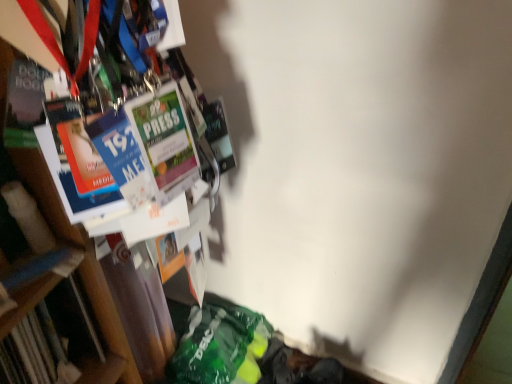
The image size is (512, 384). What do you see at coordinates (79, 321) in the screenshot?
I see `wooden bookcase at left` at bounding box center [79, 321].

Where is `wooden bookcase at left`? This screenshot has height=384, width=512. wooden bookcase at left is located at coordinates (79, 321).

The image size is (512, 384). Describe the element at coordinates (36, 351) in the screenshot. I see `hardcover book at left` at that location.

You are a GUI agent. You are given a task and a screenshot of the screen. Output one action in this format:
    pyautogui.click(x=<x>, y=<y>)
    Task: Click on the hardcover book at left
    The width and height of the screenshot is (512, 384).
    Given the screenshot: What is the action you would take?
    pyautogui.click(x=36, y=351)

At what (x,y) coordinates should I click in order to perform the action: click on wooden bookcase at left. Please return your answer as a coordinate pair (x, y). The width and height of the screenshot is (512, 384). Looking at the image, I should click on (79, 321).

Consider the image. Considering the relative positions of wooden bookcase at left and hardcover book at left in the image provided, is wooden bookcase at left to the right of hardcover book at left from the viewer's perspective?

Yes, wooden bookcase at left is to the right of hardcover book at left.

Relative to hardcover book at left, is wooden bookcase at left in front or behind?

In the image, wooden bookcase at left appears in front of hardcover book at left.

Considering the positions of points (115, 335) and (15, 370), is point (115, 335) closer to camera compared to point (15, 370)?

No, it is behind (15, 370).

Based on the photo, from the image's perspective, which one is positioned higher, wooden bookcase at left or hardcover book at left?

wooden bookcase at left.

From a real-world perspective, is wooden bookcase at left positioned under hardcover book at left based on gravity?

No, from a real-world perspective, wooden bookcase at left is not below hardcover book at left.

Which of these two, wooden bookcase at left or hardcover book at left, is wider?

Wider between the two is wooden bookcase at left.

Which of these two, wooden bookcase at left or hardcover book at left, stands shorter?

Standing shorter between the two is hardcover book at left.

Is wooden bookcase at left bigger than hardcover book at left?

Correct, wooden bookcase at left is larger in size than hardcover book at left.

Is wooden bookcase at left situated inside hardcover book at left or outside?

wooden bookcase at left is not inside hardcover book at left, it's outside.

Are wooden bookcase at left and hardcover book at left located far from each other?

They are positioned close to each other.

Could you tell me if wooden bookcase at left is facing hardcover book at left?

No, wooden bookcase at left is not oriented towards hardcover book at left.

Locate an element on the screen. The height and width of the screenshot is (384, 512). book that is behind the wooden bookcase at left is located at coordinates (36, 351).

Between hardcover book at left and wooden bookcase at left, which one appears on the right side from the viewer's perspective?

wooden bookcase at left is more to the right.

Is hardcover book at left in front of or behind wooden bookcase at left in the image?

Visually, hardcover book at left is located behind wooden bookcase at left.

Considering the positions of point (77, 296) and point (100, 280), is point (77, 296) closer or farther from the camera than point (100, 280)?

Point (77, 296) appears to be farther away from the viewer than point (100, 280).

From the image's perspective, is hardcover book at left beneath wooden bookcase at left?

Yes.

In the scene shown: From a real-world perspective, which object rests below the other?

hardcover book at left.

Between hardcover book at left and wooden bookcase at left, which one has larger width?

Wider between the two is wooden bookcase at left.

Considering the sizes of objects hardcover book at left and wooden bookcase at left in the image provided, who is shorter, hardcover book at left or wooden bookcase at left?

With less height is hardcover book at left.

Can you confirm if hardcover book at left is smaller than wooden bookcase at left?

Correct, hardcover book at left occupies less space than wooden bookcase at left.

Can we say hardcover book at left lies outside wooden bookcase at left?

Yes.

Is hardcover book at left directly adjacent to wooden bookcase at left?

Yes, hardcover book at left is next to wooden bookcase at left.

Could you tell me if hardcover book at left is facing wooden bookcase at left?

No, hardcover book at left is not turned towards wooden bookcase at left.

Can you tell me how much hardcover book at left and wooden bookcase at left differ in facing direction?

The facing directions of hardcover book at left and wooden bookcase at left are 20.4 degrees apart.

Where is `bookcase in front of the hardcover book at left`? The width and height of the screenshot is (512, 384). bookcase in front of the hardcover book at left is located at coordinates (79, 321).

Where is `book directly beneath the wooden bookcase at left (from a real-world perspective)`? The image size is (512, 384). book directly beneath the wooden bookcase at left (from a real-world perspective) is located at coordinates (36, 351).

In order to click on book on the left of wooden bookcase at left in this screenshot , I will do `click(36, 351)`.